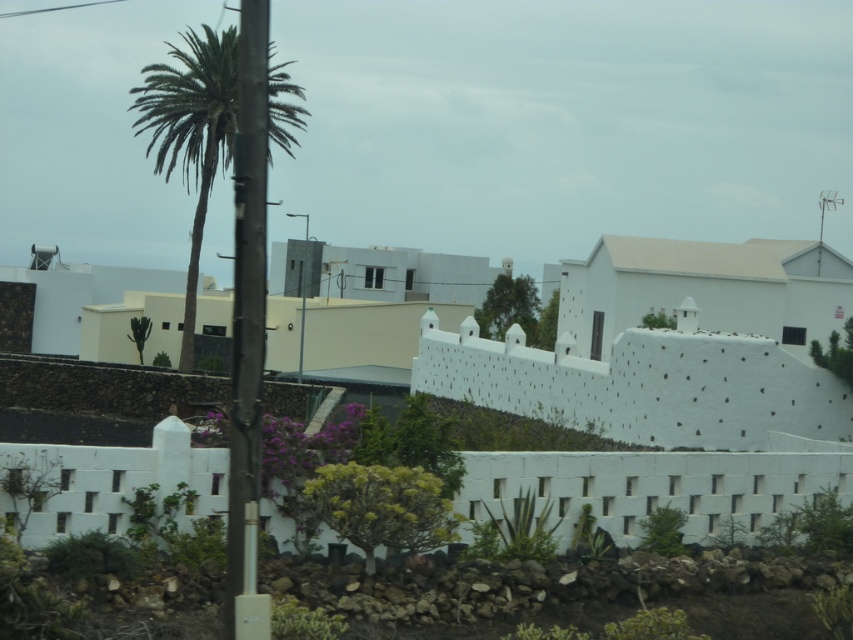
Question: Observing the image, what is the correct spatial positioning of metallic pole at left in reference to green leafy palm at upper left?

Choices:
 (A) below
 (B) above

Answer: (A)

Question: Which point is farther to the camera?

Choices:
 (A) pyautogui.click(x=241, y=221)
 (B) pyautogui.click(x=190, y=358)

Answer: (B)

Question: Can you confirm if white concrete wall at center is positioned above metallic pole at left?

Choices:
 (A) no
 (B) yes

Answer: (A)

Question: Does white concrete wall at center appear on the right side of green leafy palm at upper left?

Choices:
 (A) no
 (B) yes

Answer: (B)

Question: Which object is closer to the camera taking this photo?

Choices:
 (A) metallic pole at left
 (B) green leafy palm at upper left
 (C) white concrete wall at center

Answer: (A)

Question: Which object is farther from the camera taking this photo?

Choices:
 (A) metallic pole at left
 (B) white concrete wall at center

Answer: (B)